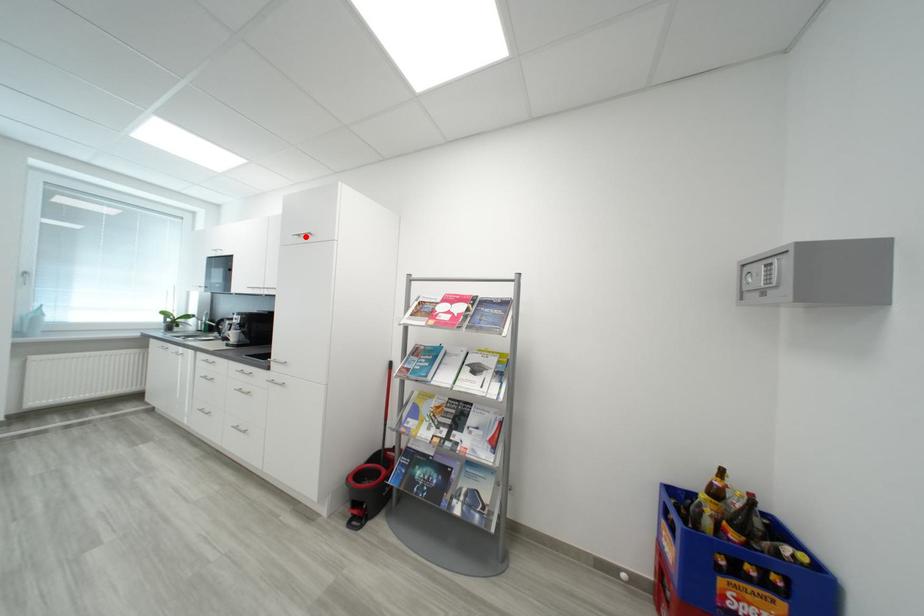
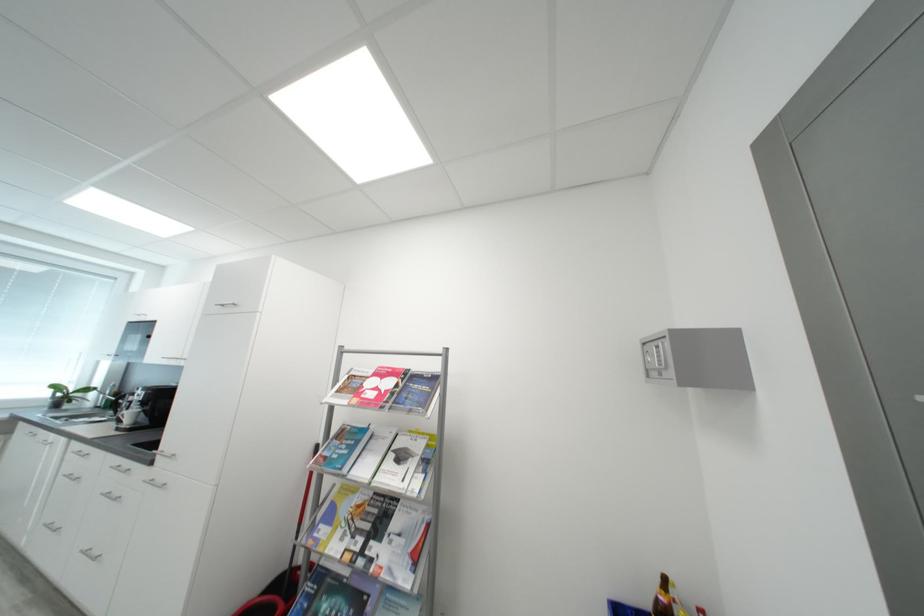
Find the pixel in the second image that matches the highlighted location in the first image.

(228, 307)